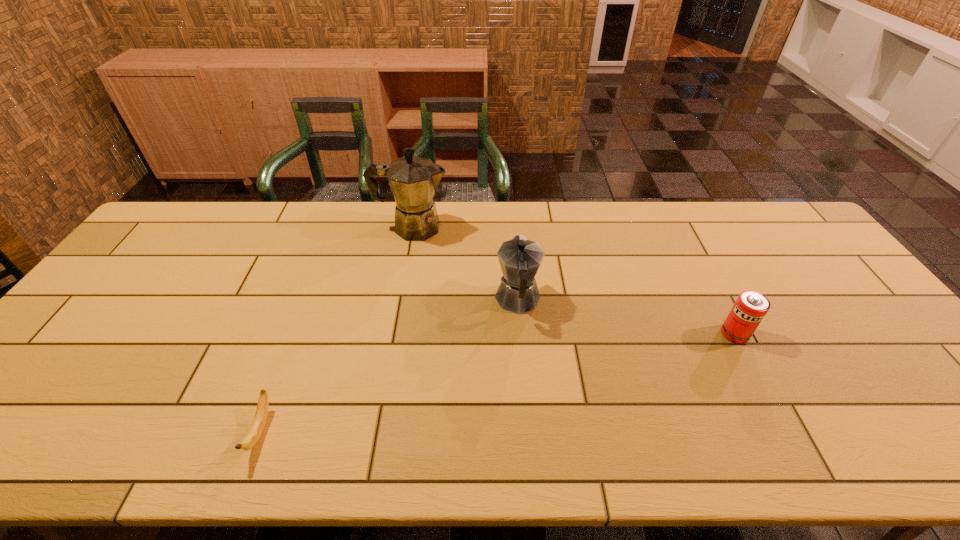
Where is `object that stands as the second closest to the can`? Image resolution: width=960 pixels, height=540 pixels. object that stands as the second closest to the can is located at coordinates coord(413,180).

Locate an element on the screen. Image resolution: width=960 pixels, height=540 pixels. vacant region that satisfies the following two spatial constraints: 1. on the pouring side of the tallest object; 2. at the spout of the nearer coffeepot is located at coordinates (399, 300).

Identify the location of free space that satisfies the following two spatial constraints: 1. on the pouring side of the left coffeepot; 2. on the back side of the can. (393, 334).

I want to click on free spot that satisfies the following two spatial constraints: 1. at the spout of the third shortest object; 2. on the pouring side of the tallest object, so click(x=512, y=227).

Locate an element on the screen. This screenshot has height=540, width=960. free location that satisfies the following two spatial constraints: 1. on the pouring side of the third object from right to left; 2. at the stem of the leftmost object is located at coordinates (375, 431).

The image size is (960, 540). In order to click on vacant position in the image that satisfies the following two spatial constraints: 1. on the pouring side of the farthest object; 2. at the spout of the third object from left to right in this screenshot , I will do `click(399, 300)`.

You are a GUI agent. You are given a task and a screenshot of the screen. Output one action in this format:
    pyautogui.click(x=<x>, y=<y>)
    Task: Click on the free space that satisfies the following two spatial constraints: 1. on the pouring side of the farther coffeepot; 2. at the stem of the nearest object
    The width and height of the screenshot is (960, 540).
    Given the screenshot: What is the action you would take?
    pyautogui.click(x=375, y=431)